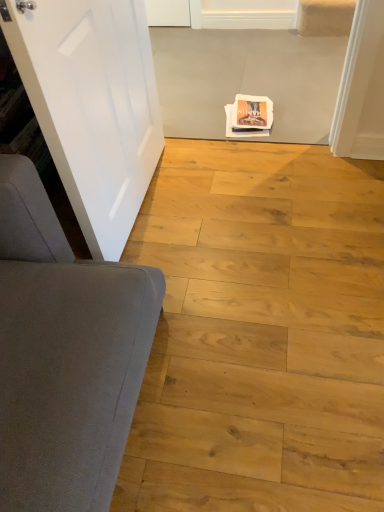
Question: From a real-world perspective, is natural wood floor at center positioned above or below white matte door at left?

Choices:
 (A) above
 (B) below

Answer: (B)

Question: Is natural wood floor at center bigger or smaller than white matte door at left?

Choices:
 (A) small
 (B) big

Answer: (B)

Question: Is natural wood floor at center taller or shorter than white matte door at left?

Choices:
 (A) tall
 (B) short

Answer: (B)

Question: From their relative heights in the image, would you say white matte door at left is taller or shorter than natural wood floor at center?

Choices:
 (A) tall
 (B) short

Answer: (A)

Question: From a real-world perspective, is white matte door at left positioned above or below natural wood floor at center?

Choices:
 (A) above
 (B) below

Answer: (A)

Question: Looking at their shapes, would you say white matte door at left is wider or thinner than natural wood floor at center?

Choices:
 (A) thin
 (B) wide

Answer: (A)

Question: Is white matte door at left inside or outside of natural wood floor at center?

Choices:
 (A) outside
 (B) inside

Answer: (A)